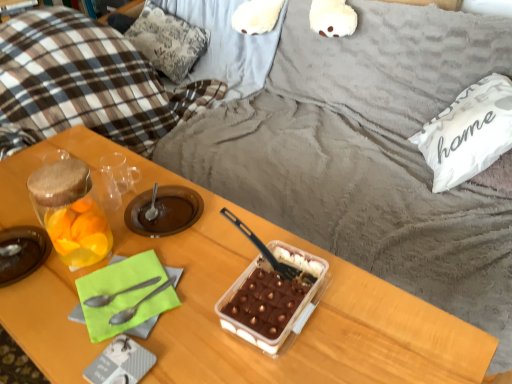
Find the location of a particular element. This screenshot has height=384, width=512. blank space to the left of translucent plastic tray at center, the 2th snack positioned from the left is located at coordinates (201, 304).